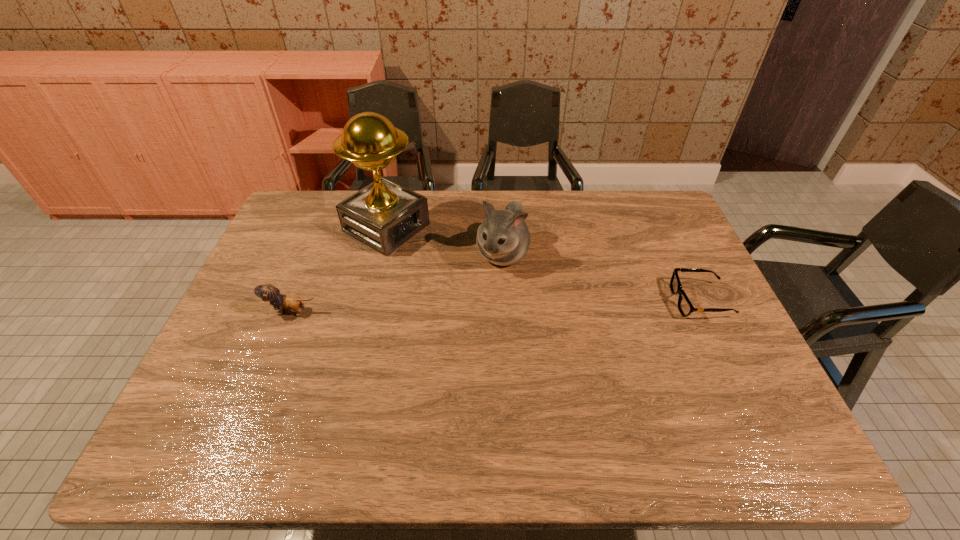
Locate an element on the screen. the second shortest object is located at coordinates (268, 292).

In order to click on the rightmost object in this screenshot , I will do `click(685, 307)`.

Where is `sunglasses`? The width and height of the screenshot is (960, 540). sunglasses is located at coordinates (685, 307).

You are a GUI agent. You are given a task and a screenshot of the screen. Output one action in this format:
    pyautogui.click(x=<x>, y=<y>)
    Task: Click on the hamster
    
    Given the screenshot: What is the action you would take?
    pyautogui.click(x=503, y=238)

At what (x,y) coordinates should I click in order to perform the action: click on the third object from left to right. Please return your answer as a coordinate pair (x, y). The height and width of the screenshot is (540, 960). Looking at the image, I should click on (503, 238).

Identify the location of award. The width and height of the screenshot is (960, 540). (384, 215).

Locate an element on the screen. The image size is (960, 540). vacant space situated on the front-facing side of the rightmost object is located at coordinates (623, 301).

At what (x,y) coordinates should I click in order to perform the action: click on vacant point located on the front-facing side of the rightmost object. Please return your answer as a coordinate pair (x, y). Looking at the image, I should click on (565, 301).

This screenshot has width=960, height=540. I want to click on free location located 0.180m on the front-facing side of the rightmost object, so click(x=609, y=301).

Image resolution: width=960 pixels, height=540 pixels. I want to click on free space located on the face of the second object from right to left, so click(x=444, y=367).